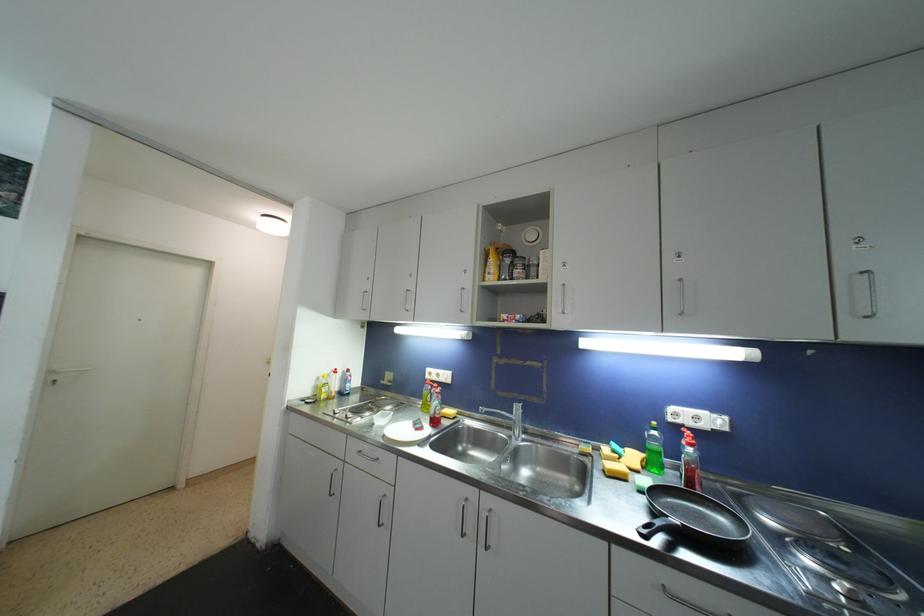
Describe the element at coordinates (508, 419) in the screenshot. This screenshot has height=616, width=924. I see `a faucet handle` at that location.